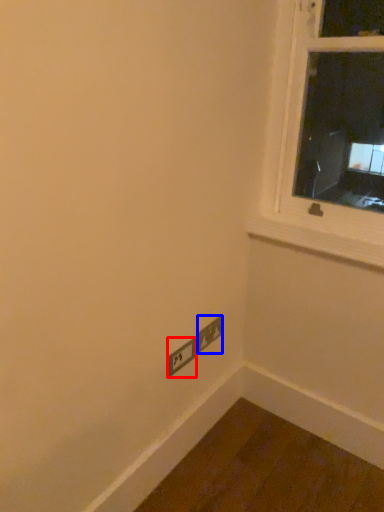
Question: Which of the following is the closest to the observer, power plugs and sockets (highlighted by a red box) or power plugs and sockets (highlighted by a blue box)?

Choices:
 (A) power plugs and sockets
 (B) power plugs and sockets

Answer: (A)